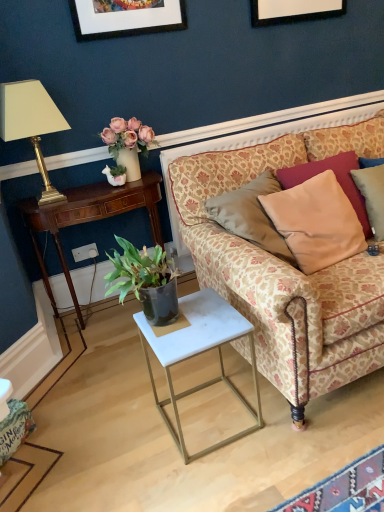
Question: Is white marble table at lower center taller than beige fabric pillow at right, the second pillow positioned from the front?

Choices:
 (A) no
 (B) yes

Answer: (B)

Question: Is white marble table at lower center positioned with its back to beige fabric pillow at right, acting as the first pillow starting from the back?

Choices:
 (A) yes
 (B) no

Answer: (B)

Question: Does white marble table at lower center appear on the left side of beige fabric pillow at right, the second pillow positioned from the front?

Choices:
 (A) no
 (B) yes

Answer: (B)

Question: Considering the relative sizes of white marble table at lower center and beige fabric pillow at right, acting as the first pillow starting from the back, in the image provided, is white marble table at lower center smaller than beige fabric pillow at right, acting as the first pillow starting from the back,?

Choices:
 (A) no
 (B) yes

Answer: (A)

Question: Are white marble table at lower center and beige fabric pillow at right, acting as the first pillow starting from the back, located far from each other?

Choices:
 (A) no
 (B) yes

Answer: (A)

Question: Considering their positions, is white plastic power outlet at lower left located in front of or behind beige fabric pillow at upper right, marked as the first pillow in a front-to-back arrangement?

Choices:
 (A) front
 (B) behind

Answer: (B)

Question: From the image's perspective, relative to beige fabric pillow at upper right, marked as the first pillow in a front-to-back arrangement, is white plastic power outlet at lower left above or below?

Choices:
 (A) below
 (B) above

Answer: (A)

Question: In terms of height, does white plastic power outlet at lower left look taller or shorter compared to beige fabric pillow at upper right, marked as the first pillow in a front-to-back arrangement?

Choices:
 (A) short
 (B) tall

Answer: (A)

Question: Does point (96, 247) appear closer or farther from the camera than point (309, 253)?

Choices:
 (A) farther
 (B) closer

Answer: (A)

Question: In terms of height, does white marble table at lower center look taller or shorter compared to white plastic power outlet at lower left?

Choices:
 (A) tall
 (B) short

Answer: (A)

Question: Is point tap(168, 342) positioned closer to the camera than point tap(84, 246)?

Choices:
 (A) closer
 (B) farther

Answer: (A)

Question: Is white marble table at lower center to the left or to the right of white plastic power outlet at lower left in the image?

Choices:
 (A) left
 (B) right

Answer: (B)

Question: Is white marble table at lower center spatially inside white plastic power outlet at lower left, or outside of it?

Choices:
 (A) inside
 (B) outside

Answer: (B)

Question: Is mahogany wood desk at left inside the boundaries of beige fabric pillow at upper right, marked as the first pillow in a front-to-back arrangement, or outside?

Choices:
 (A) outside
 (B) inside

Answer: (A)

Question: In the image, is mahogany wood desk at left positioned in front of or behind beige fabric pillow at upper right, marked as the first pillow in a front-to-back arrangement?

Choices:
 (A) front
 (B) behind

Answer: (B)